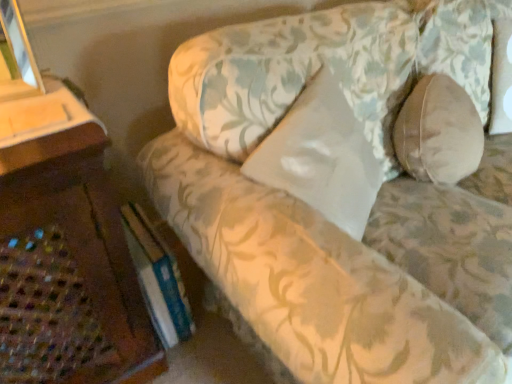
Question: From the image's perspective, is white satin pillow at center, which is the second pillow in right-to-left order, over floral fabric couch at center?

Choices:
 (A) no
 (B) yes

Answer: (A)

Question: Is white satin pillow at center, acting as the first pillow starting from the left, not near floral fabric couch at center?

Choices:
 (A) yes
 (B) no

Answer: (B)

Question: From a real-world perspective, is white satin pillow at center, which is the second pillow in right-to-left order, physically below floral fabric couch at center?

Choices:
 (A) yes
 (B) no

Answer: (B)

Question: Is the depth of white satin pillow at center, acting as the first pillow starting from the left, greater than that of floral fabric couch at center?

Choices:
 (A) no
 (B) yes

Answer: (B)

Question: Can you confirm if white satin pillow at center, acting as the first pillow starting from the left, is taller than floral fabric couch at center?

Choices:
 (A) yes
 (B) no

Answer: (B)

Question: Is floral fabric couch at center in front of or behind white satin pillow at center, which is the second pillow in right-to-left order, in the image?

Choices:
 (A) behind
 (B) front

Answer: (B)

Question: Considering the positions of point (385, 132) and point (352, 200), is point (385, 132) closer or farther from the camera than point (352, 200)?

Choices:
 (A) closer
 (B) farther

Answer: (B)

Question: In terms of height, does floral fabric couch at center look taller or shorter compared to white satin pillow at center, acting as the first pillow starting from the left?

Choices:
 (A) tall
 (B) short

Answer: (A)

Question: Visually, is floral fabric couch at center positioned to the left or to the right of white satin pillow at center, acting as the first pillow starting from the left?

Choices:
 (A) right
 (B) left

Answer: (A)

Question: Considering the positions of hardcover book at lower left and beige fabric pillow at right, the second pillow from the left, in the image, is hardcover book at lower left bigger or smaller than beige fabric pillow at right, the second pillow from the left,?

Choices:
 (A) big
 (B) small

Answer: (B)

Question: Considering their positions, is hardcover book at lower left located in front of or behind beige fabric pillow at right, the second pillow from the left?

Choices:
 (A) front
 (B) behind

Answer: (A)

Question: Is hardcover book at lower left inside the boundaries of beige fabric pillow at right, the second pillow from the left, or outside?

Choices:
 (A) outside
 (B) inside

Answer: (A)

Question: In terms of height, does hardcover book at lower left look taller or shorter compared to beige fabric pillow at right, the first pillow positioned from the right?

Choices:
 (A) tall
 (B) short

Answer: (B)

Question: Which is correct: white satin pillow at center, which is the second pillow in right-to-left order, is inside hardcover book at lower left, or outside of it?

Choices:
 (A) inside
 (B) outside

Answer: (B)

Question: In terms of width, does white satin pillow at center, acting as the first pillow starting from the left, look wider or thinner when compared to hardcover book at lower left?

Choices:
 (A) wide
 (B) thin

Answer: (B)